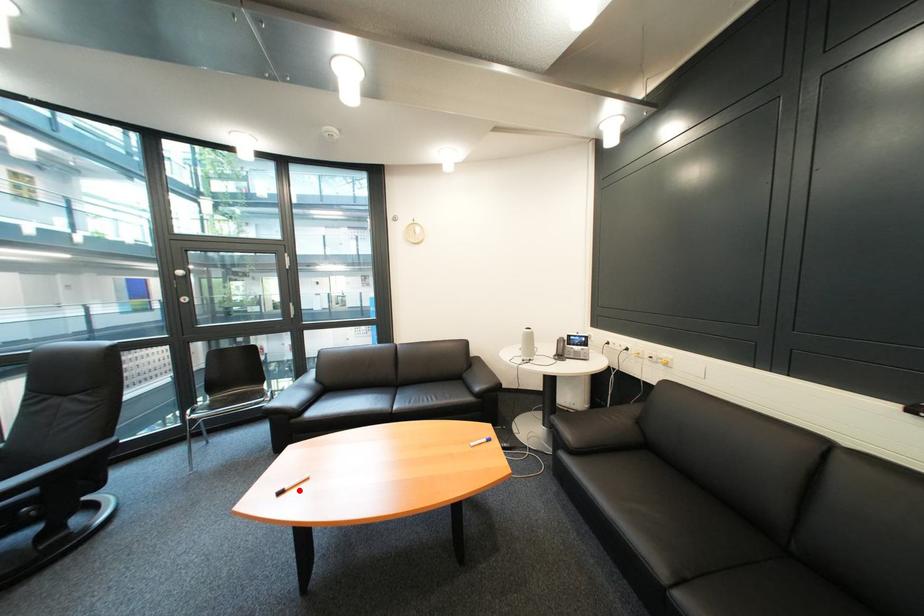
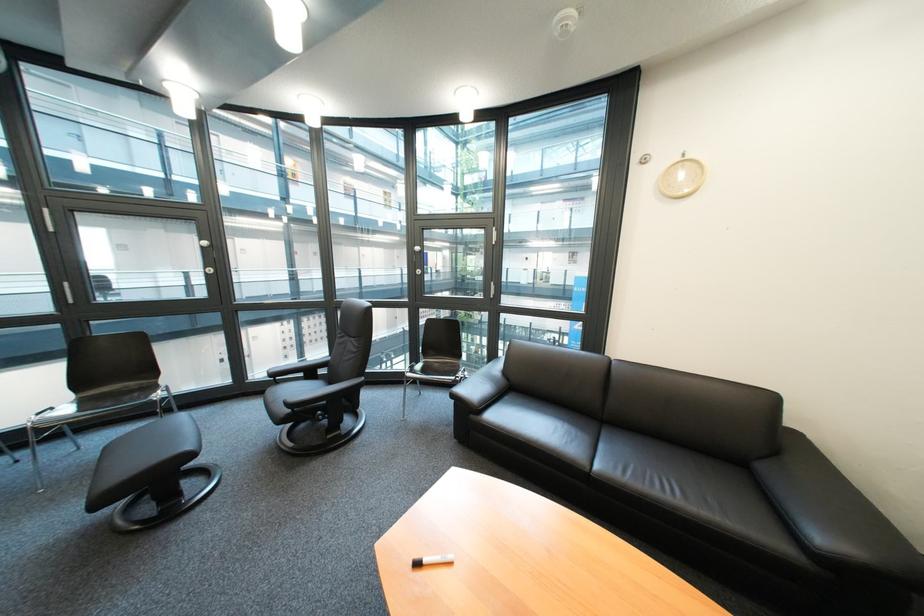
Locate, in the second image, the point that corresponds to the highlighted location in the first image.

(438, 562)